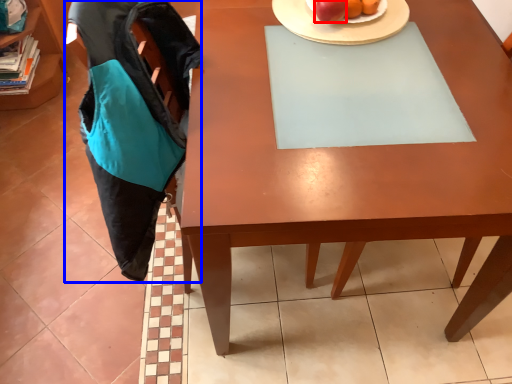
Question: Which object is further to the camera taking this photo, apple (highlighted by a red box) or swivel chair (highlighted by a blue box)?

Choices:
 (A) apple
 (B) swivel chair

Answer: (A)